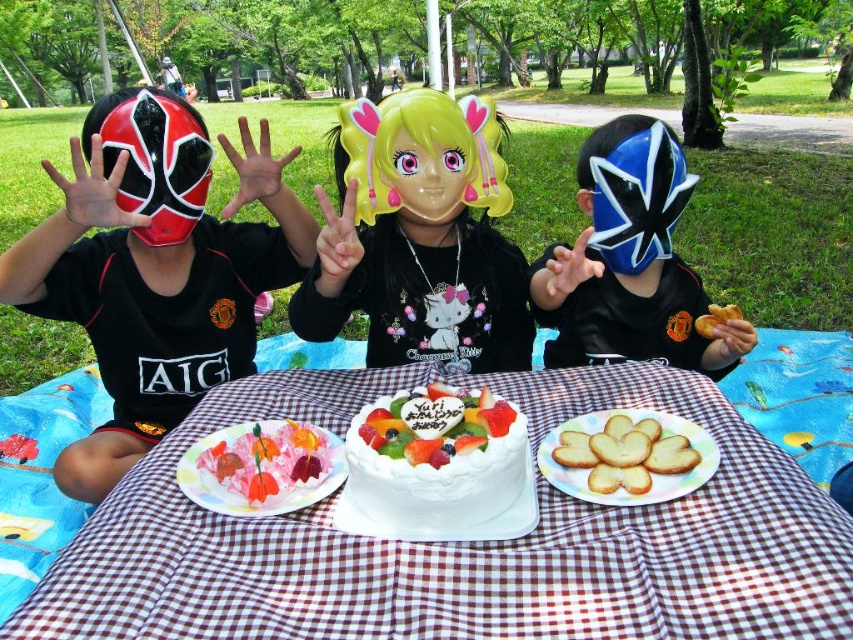
Does matte black mask at left appear on the right side of glossy plastic mask at center?

In fact, matte black mask at left is to the left of glossy plastic mask at center.

Image resolution: width=853 pixels, height=640 pixels. I want to click on matte black mask at left, so click(x=154, y=292).

Does white checkered tablecloth at center come behind pink glossy cake at center?

No, white checkered tablecloth at center is closer to the viewer.

Is point (648, 536) closer to viewer compared to point (271, 464)?

Yes.

Where is `white checkered tablecloth at center`? white checkered tablecloth at center is located at coordinates (457, 544).

Does matte black mask at left have a lesser height compared to golden crispy bread at center?

No.

Where is `matte black mask at left`? The height and width of the screenshot is (640, 853). matte black mask at left is located at coordinates (154, 292).

This screenshot has width=853, height=640. In order to click on matte black mask at left in this screenshot , I will do `click(154, 292)`.